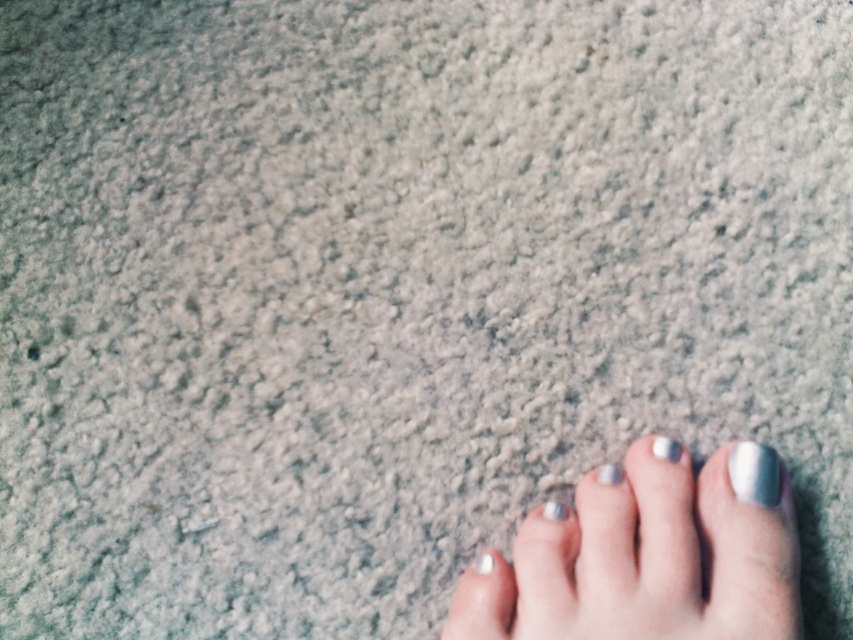
You are a photographer trying to capture the reflection of the silver metallic nail at center and the silver metallic toe at center in the textured surface. Which one do you think will cast a clearer reflection?

The silver metallic nail at center is positioned over the silver metallic toe at center, so it will cast a clearer reflection because it is closer to the surface.

You are designing a custom sandal for someone with a foot like the one shown. The sandal has two straps that need to align precisely with the silver metallic toe at center and the silver metallic toe at lower center. Given their widths, which toe should the wider strap be placed around?

The silver metallic toe at lower center has a greater width than the silver metallic toe at center, so the wider strap should be placed around the silver metallic toe at lower center.